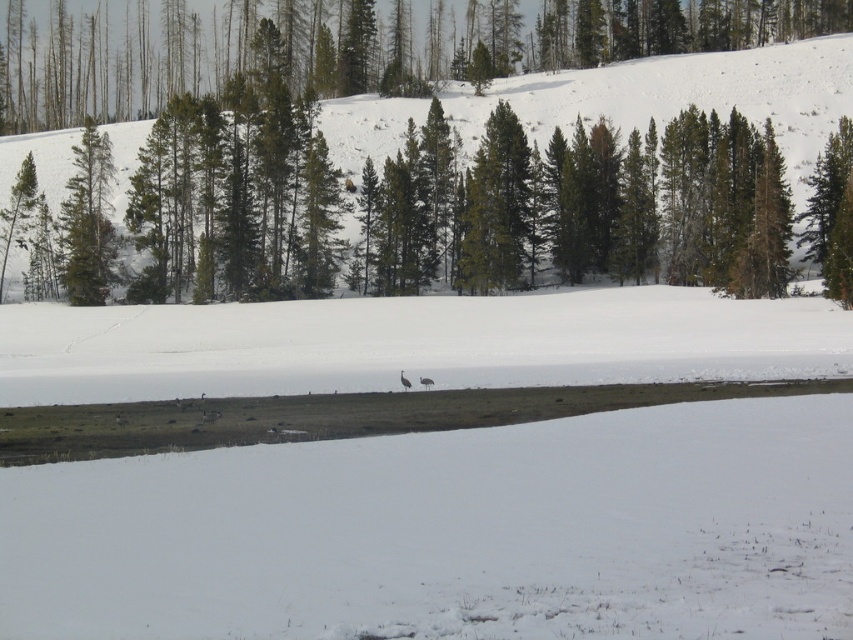
Question: Does green matte tree at upper center have a larger size compared to green matte trees at center?

Choices:
 (A) no
 (B) yes

Answer: (B)

Question: Does green matte tree at upper center have a larger size compared to green matte trees at center?

Choices:
 (A) no
 (B) yes

Answer: (B)

Question: Which of the following is the farthest from the observer?

Choices:
 (A) green matte tree at upper center
 (B) green matte trees at center

Answer: (A)

Question: Is green matte tree at upper center to the left of green matte trees at center from the viewer's perspective?

Choices:
 (A) yes
 (B) no

Answer: (A)

Question: Which point is closer to the camera taking this photo?

Choices:
 (A) [x=99, y=29]
 (B) [x=358, y=106]

Answer: (B)